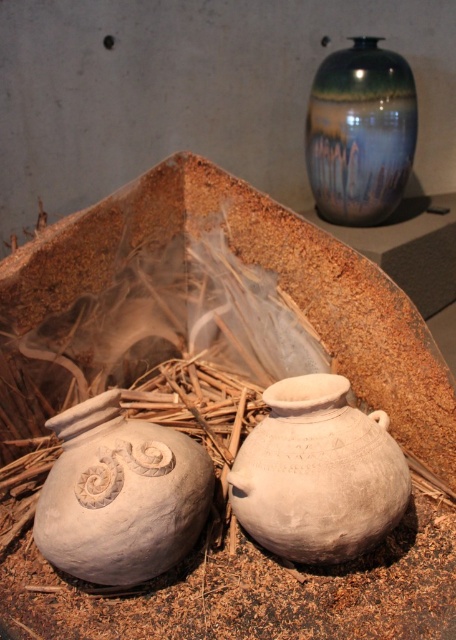
Consider the image. Is white matte clay pot at center smaller than shiny ceramic vase at upper right?

Yes, white matte clay pot at center is smaller than shiny ceramic vase at upper right.

Is point (385, 428) farther from camera compared to point (394, 179)?

No, it is not.

Identify the location of white matte clay pot at center. The image size is (456, 640). (317, 474).

Which is behind, point (141, 468) or point (343, 408)?

The point (343, 408) is behind.

Can you confirm if white clay pot at lower left is shorter than white matte clay pot at center?

No, white clay pot at lower left is not shorter than white matte clay pot at center.

Between point (108, 470) and point (238, 484), which one is positioned behind?

Positioned behind is point (238, 484).

Find the location of `white clay pot at lower left`. white clay pot at lower left is located at coordinates (120, 493).

Is white clay pot at lower left below shiny ceramic vase at upper right?

Indeed, white clay pot at lower left is positioned under shiny ceramic vase at upper right.

Is white clay pot at lower left above shiny ceramic vase at upper right?

Incorrect, white clay pot at lower left is not positioned above shiny ceramic vase at upper right.

Locate an element on the screen. Image resolution: width=456 pixels, height=640 pixels. white clay pot at lower left is located at coordinates (120, 493).